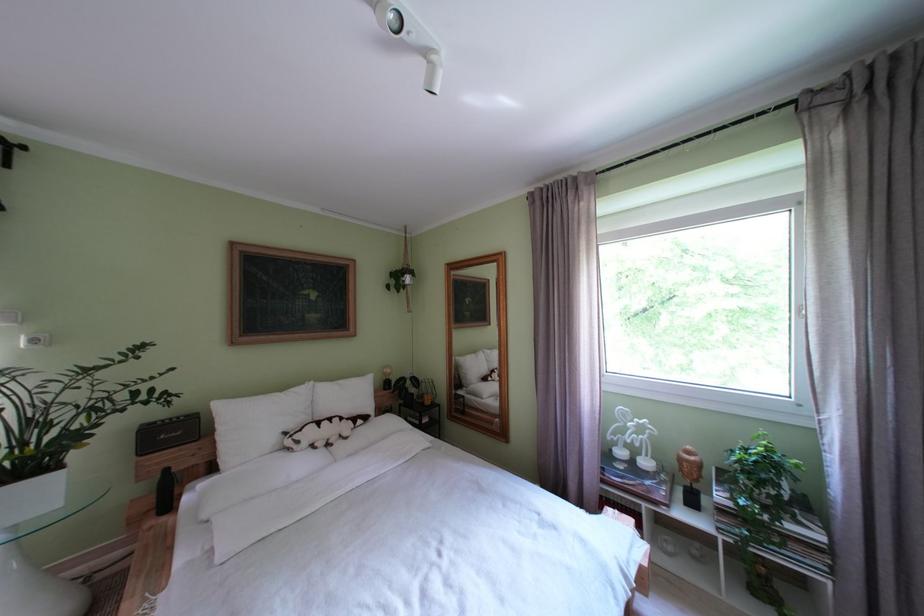
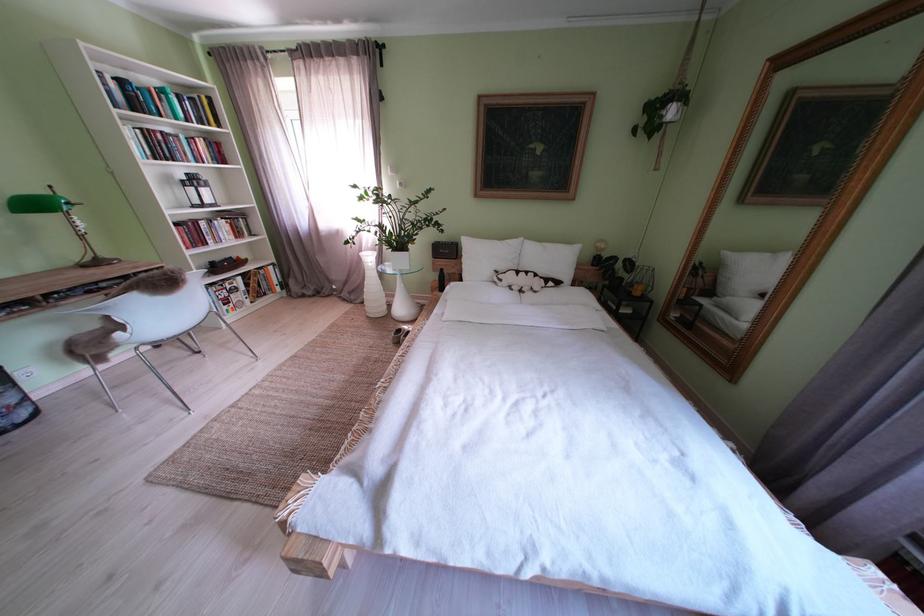
Find the pixel in the second image that matches point (261, 429) in the first image.

(490, 262)